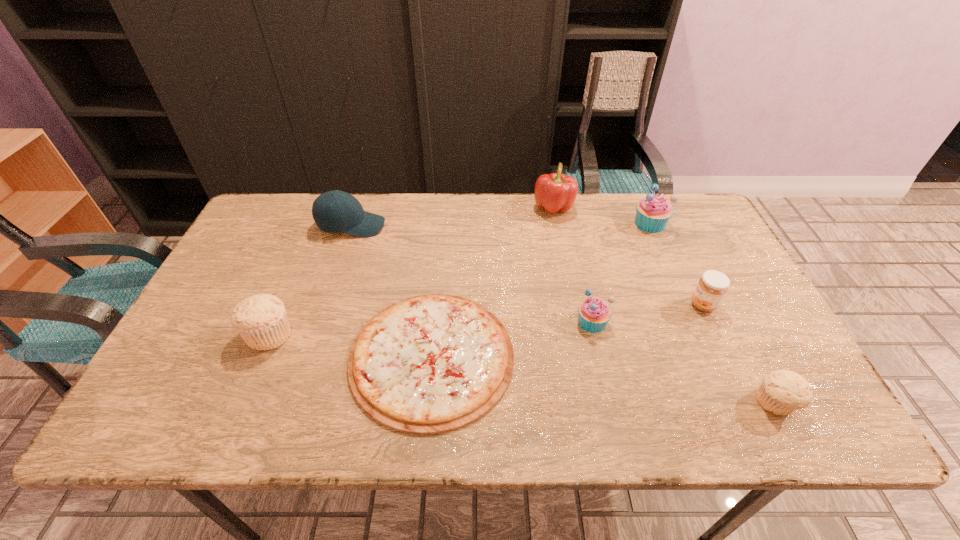
Where is `vacant position in the image that satisfies the following two spatial constraints: 1. on the front label of the orange jam; 2. on the right side of the rightmost muffin`? vacant position in the image that satisfies the following two spatial constraints: 1. on the front label of the orange jam; 2. on the right side of the rightmost muffin is located at coordinates (750, 403).

Locate an element on the screen. This screenshot has height=540, width=960. free spot that satisfies the following two spatial constraints: 1. on the front-facing side of the blue baseball cap; 2. on the left side of the second muffin from left to right is located at coordinates (320, 322).

Locate an element on the screen. Image resolution: width=960 pixels, height=540 pixels. vacant region that satisfies the following two spatial constraints: 1. on the front label of the nearest muffin; 2. on the right side of the orange jam is located at coordinates (750, 403).

This screenshot has width=960, height=540. Find the location of `vacant space that satisfies the following two spatial constraints: 1. on the front label of the jam; 2. on the front side of the smaller blue muffin`. vacant space that satisfies the following two spatial constraints: 1. on the front label of the jam; 2. on the front side of the smaller blue muffin is located at coordinates pos(711,322).

You are a GUI agent. You are given a task and a screenshot of the screen. Output one action in this format:
    pyautogui.click(x=<x>, y=<y>)
    Task: Click on the free space that satisfies the following two spatial constraints: 1. on the front side of the nearest muffin; 2. on the left side of the pink pepper
    
    Given the screenshot: What is the action you would take?
    pyautogui.click(x=592, y=403)